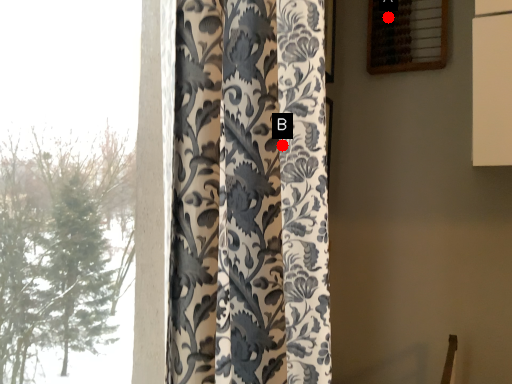
Question: Two points are circled on the image, labeled by A and B beside each circle. Which point is closer to the camera?

Choices:
 (A) A is closer
 (B) B is closer

Answer: (B)